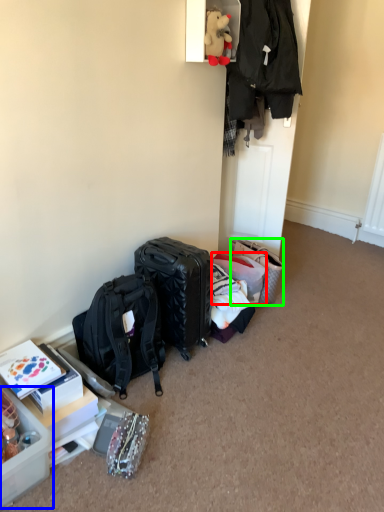
Question: Which object is the closest to the suitcase (highlighted by a red box)? Choose among these: box (highlighted by a blue box) or handbag (highlighted by a green box).

Choices:
 (A) box
 (B) handbag

Answer: (B)